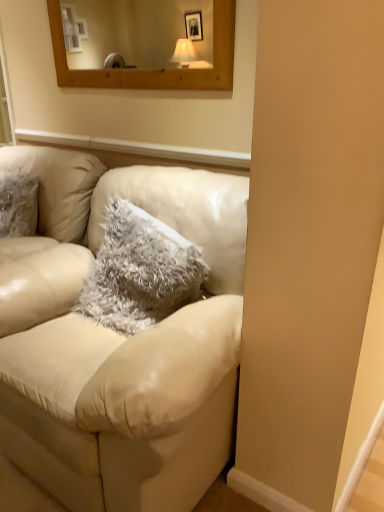
Question: Is fuzzy gray pillow at center wider than matte cream leather couch at center?

Choices:
 (A) yes
 (B) no

Answer: (B)

Question: Can you confirm if fuzzy gray pillow at center is smaller than matte cream leather couch at center?

Choices:
 (A) yes
 (B) no

Answer: (A)

Question: Is fuzzy gray pillow at center facing towards matte cream leather couch at center?

Choices:
 (A) yes
 (B) no

Answer: (A)

Question: From the image's perspective, is fuzzy gray pillow at center below matte cream leather couch at center?

Choices:
 (A) yes
 (B) no

Answer: (B)

Question: Can you confirm if fuzzy gray pillow at center is positioned to the right of matte cream leather couch at center?

Choices:
 (A) yes
 (B) no

Answer: (A)

Question: Is fuzzy gray pillow at center thinner than matte cream leather couch at center?

Choices:
 (A) no
 (B) yes

Answer: (B)

Question: Does matte cream leather couch at center have a larger size compared to fuzzy gray pillow at center?

Choices:
 (A) yes
 (B) no

Answer: (A)

Question: From the image's perspective, is matte cream leather couch at center over fuzzy gray pillow at center?

Choices:
 (A) no
 (B) yes

Answer: (A)

Question: Can you confirm if matte cream leather couch at center is positioned to the left of fuzzy gray pillow at center?

Choices:
 (A) no
 (B) yes

Answer: (B)

Question: Is matte cream leather couch at center looking in the opposite direction of fuzzy gray pillow at center?

Choices:
 (A) no
 (B) yes

Answer: (B)

Question: Is matte cream leather couch at center shorter than fuzzy gray pillow at center?

Choices:
 (A) yes
 (B) no

Answer: (B)

Question: Is matte cream leather couch at center directly adjacent to fuzzy gray pillow at center?

Choices:
 (A) no
 (B) yes

Answer: (A)

Question: From the image's perspective, relative to matte cream leather couch at center, is fuzzy gray pillow at center above or below?

Choices:
 (A) above
 (B) below

Answer: (A)